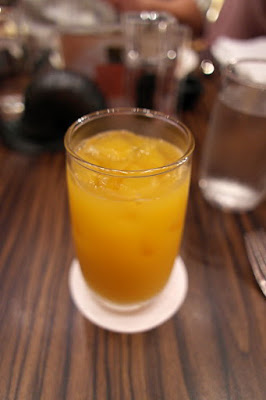
Identify the location of black cup. (189, 107).